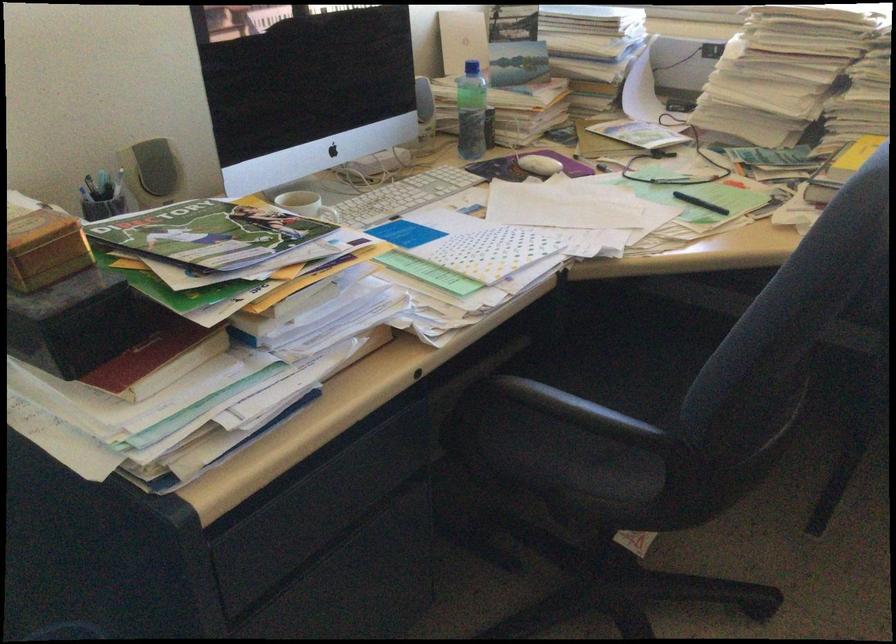
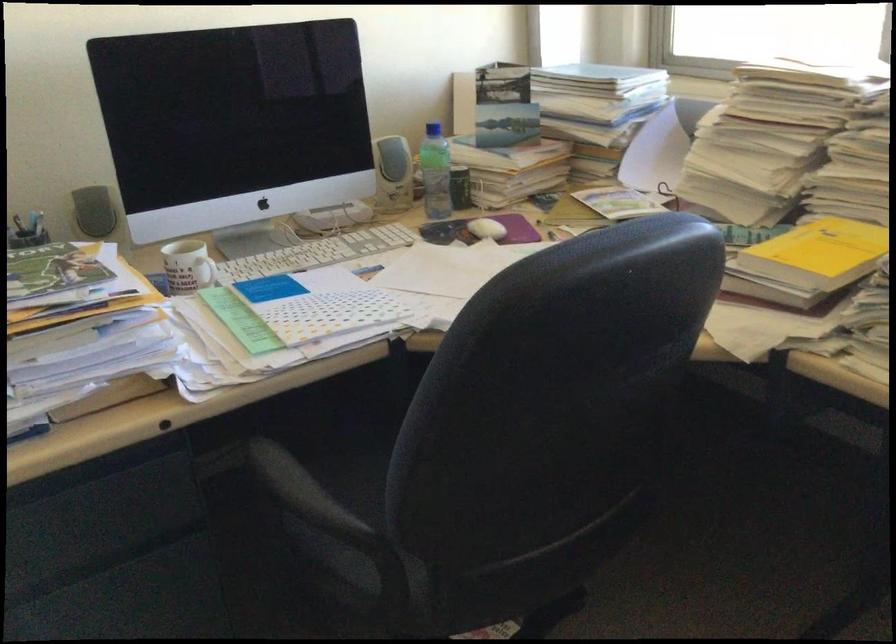
Locate, in the second image, the point that corresponds to point 168,171 in the first image.

(93, 211)